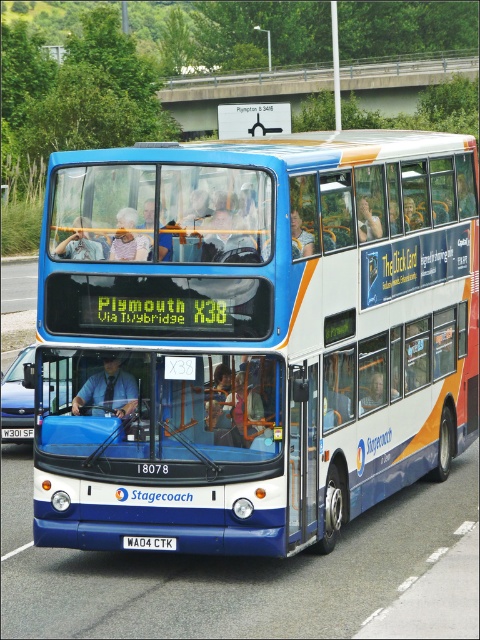
Question: Which is farther from the white plastic license plate at center?

Choices:
 (A) matte blue bus at center
 (B) asphalt road at left

Answer: (B)

Question: Can you confirm if asphalt road at left is positioned below white plastic license plate at lower center?

Choices:
 (A) yes
 (B) no

Answer: (B)

Question: Among these points, which one is nearest to the camera?

Choices:
 (A) (131, 544)
 (B) (124, 436)
 (C) (16, 305)

Answer: (B)

Question: Is white plastic license plate at center behind white plastic license plate at lower center?

Choices:
 (A) no
 (B) yes

Answer: (A)

Question: Estimate the real-world distances between objects in this image. Which object is farther from the matte blue bus at center?

Choices:
 (A) white plastic license plate at lower center
 (B) asphalt road at left

Answer: (B)

Question: Is asphalt road at left to the right of white plastic license plate at lower center from the viewer's perspective?

Choices:
 (A) yes
 (B) no

Answer: (B)